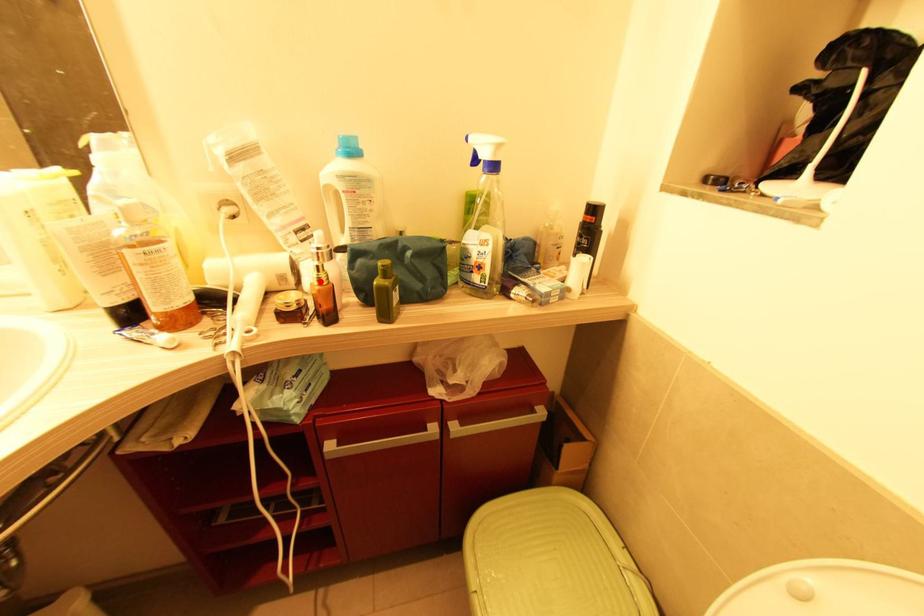
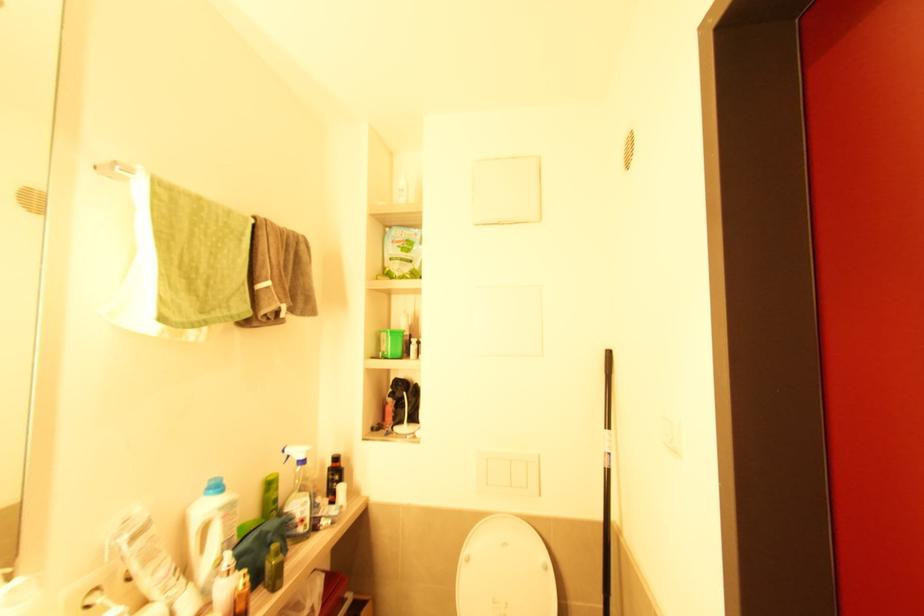
Find the pixel in the second image that matches the highlighted location in the first image.

(247, 585)